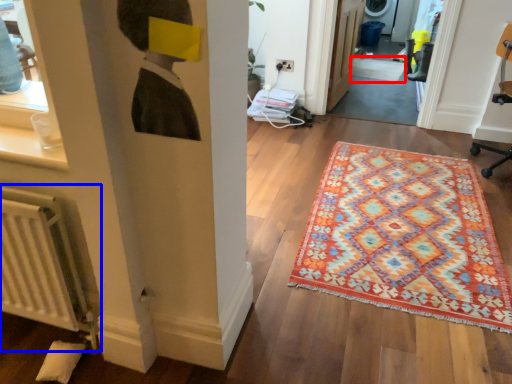
Question: Which object is closer to the camera taking this photo, doormat (highlighted by a red box) or radiator (highlighted by a blue box)?

Choices:
 (A) doormat
 (B) radiator

Answer: (B)